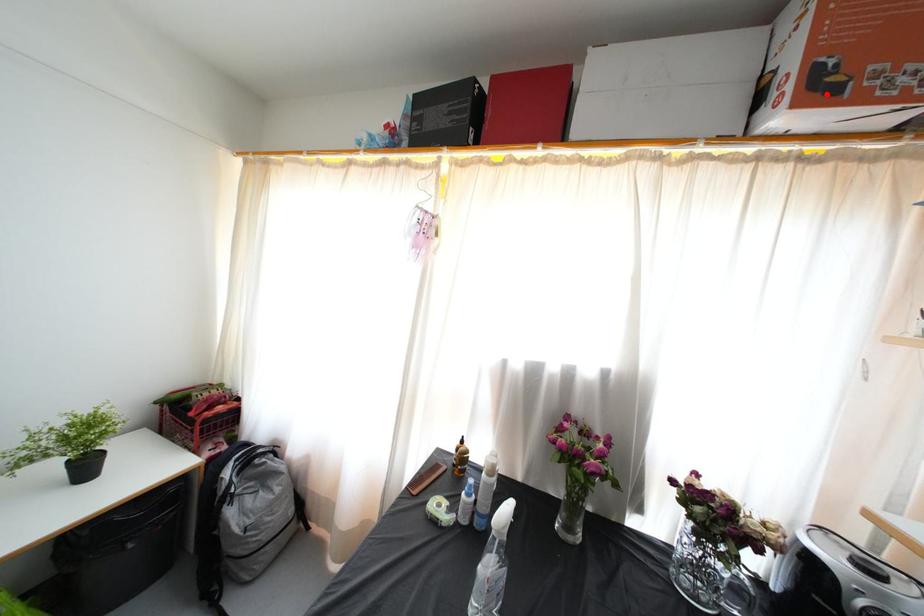
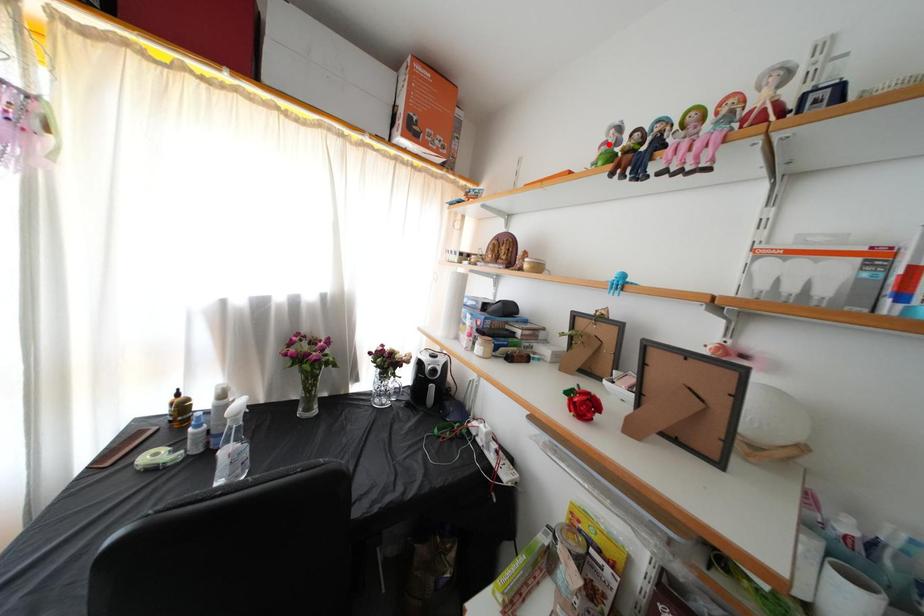
I am providing you with two images of the same scene from different viewpoints. A red point is marked on the first image and another point is marked on the second image. Is the red point in image1 aligned with the point shown in image2?

No